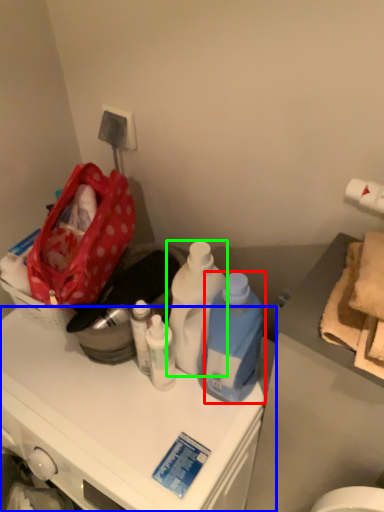
Question: Estimate the real-world distances between objects in this image. Which object is farther from bottle (highlighted by a red box), cabinetry (highlighted by a blue box) or bottle (highlighted by a green box)?

Choices:
 (A) cabinetry
 (B) bottle

Answer: (A)